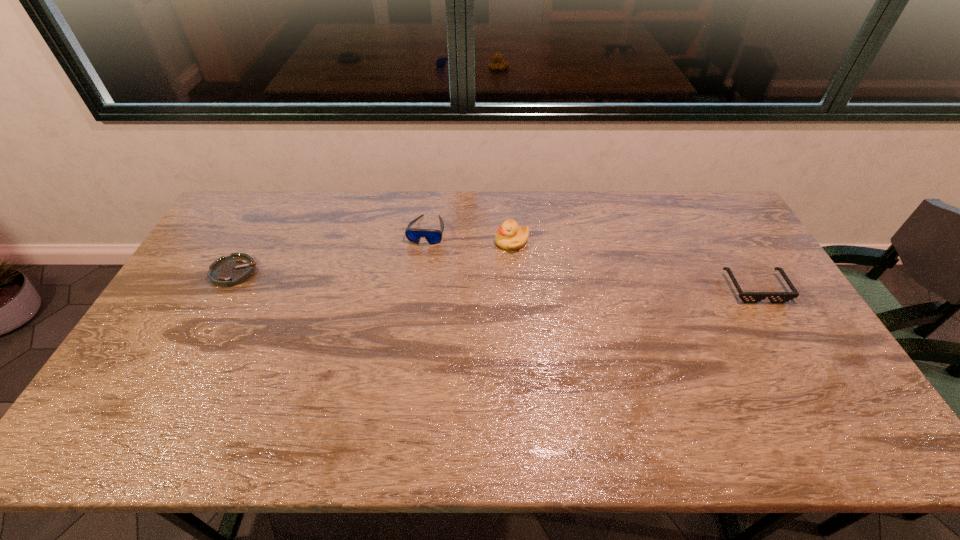
Where is `vacant space at the far edge of the desktop`? vacant space at the far edge of the desktop is located at coordinates (374, 226).

At what (x,y) coordinates should I click in order to perform the action: click on blank space at the near edge of the desktop. Please return your answer as a coordinate pair (x, y). Image resolution: width=960 pixels, height=540 pixels. Looking at the image, I should click on (371, 403).

You are a GUI agent. You are given a task and a screenshot of the screen. Output one action in this format:
    pyautogui.click(x=<x>, y=<y>)
    Task: Click on the blank space at the left edge of the desktop
    Image resolution: width=960 pixels, height=540 pixels.
    Given the screenshot: What is the action you would take?
    pyautogui.click(x=201, y=346)

Identify the location of free point at the right edge. The height and width of the screenshot is (540, 960). (799, 340).

In order to click on vacant space at the far left corner in this screenshot , I will do `click(245, 218)`.

Locate an element on the screen. This screenshot has height=540, width=960. free space at the far right corner is located at coordinates (712, 205).

Locate an element on the screen. This screenshot has width=960, height=540. free space at the near right corner of the desktop is located at coordinates (785, 384).

Where is `free spot between the ashtray and the nearer sunglasses`? The width and height of the screenshot is (960, 540). free spot between the ashtray and the nearer sunglasses is located at coordinates (494, 280).

The height and width of the screenshot is (540, 960). I want to click on vacant area between the second object from right to left and the shorter sunglasses, so click(x=634, y=265).

Locate an element on the screen. blank region between the shortest object and the shorter sunglasses is located at coordinates (494, 280).